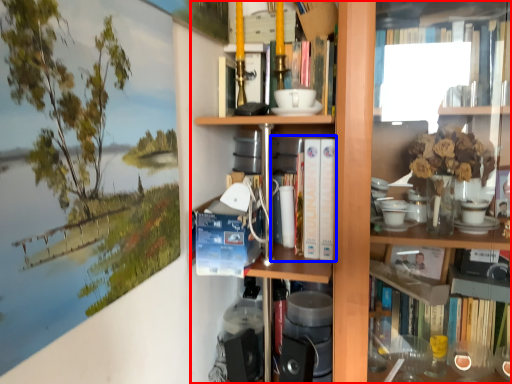
Question: Which point is closer to the camera, bookcase (highlighted by a red box) or book (highlighted by a blue box)?

Choices:
 (A) bookcase
 (B) book

Answer: (A)